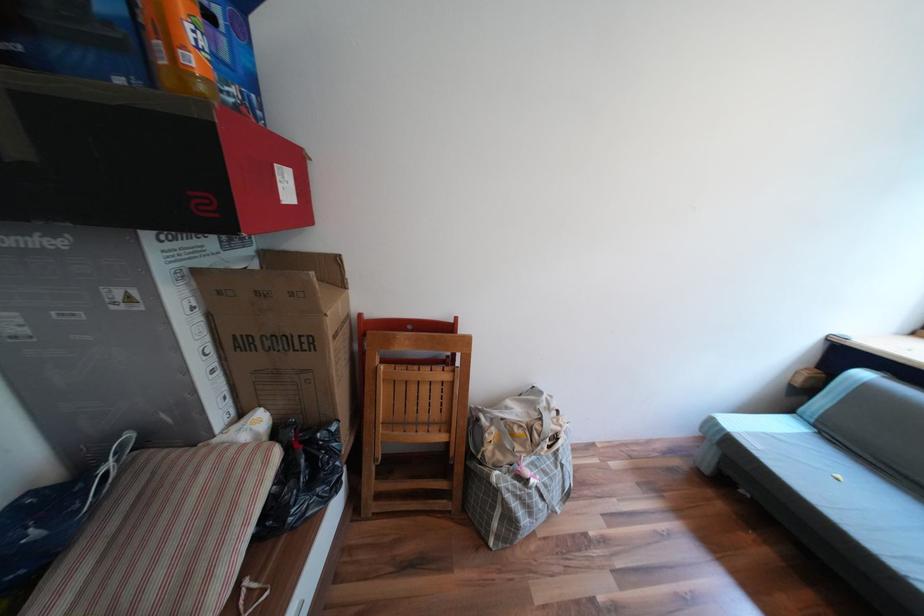
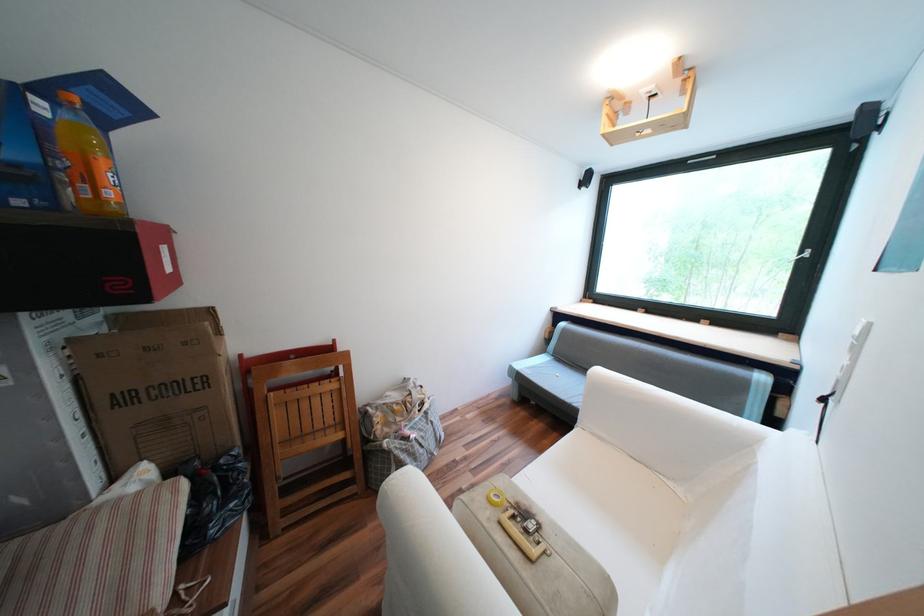
Find the pixel in the second image that matches point (495, 435) in the first image.

(383, 419)